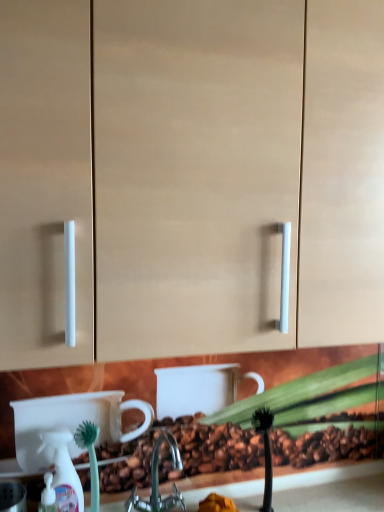
Question: Visually, is metallic silver faucet at center positioned to the left or to the right of white plastic spray bottle at lower left?

Choices:
 (A) left
 (B) right

Answer: (B)

Question: From a real-world perspective, is metallic silver faucet at center positioned above or below white plastic spray bottle at lower left?

Choices:
 (A) above
 (B) below

Answer: (B)

Question: Estimate the real-world distances between objects in this image. Which object is farther from the metallic silver faucet at center?

Choices:
 (A) green bristle brush at lower left
 (B) white plastic spray bottle at lower left
 (C) matte beige cabinet at center

Answer: (C)

Question: Which object is positioned closest to the matte beige cabinet at center?

Choices:
 (A) white plastic spray bottle at lower left
 (B) green bristle brush at lower left
 (C) metallic silver faucet at center

Answer: (B)